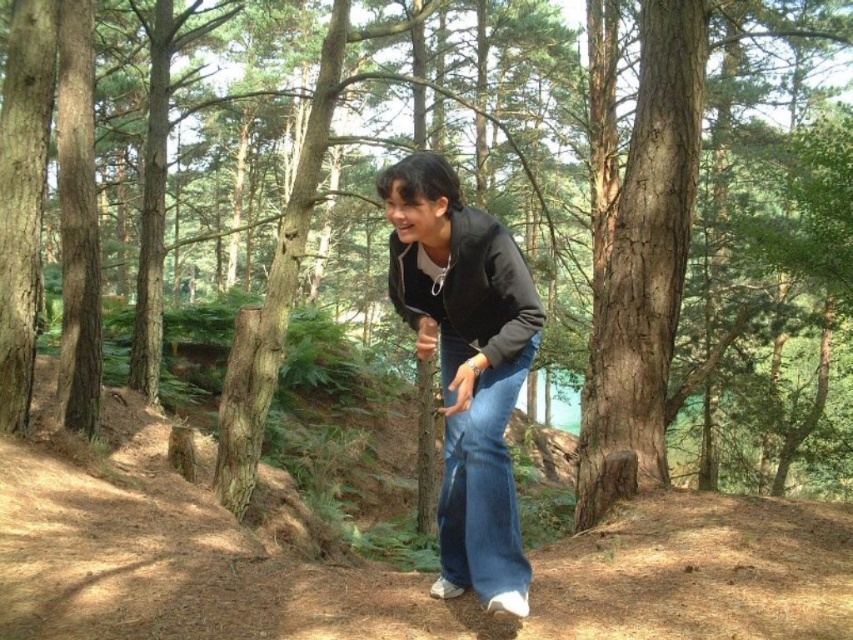
Looking at this image, is matte black jacket at center taller than denim at center?

Yes.

Who is more forward, (x=440, y=220) or (x=463, y=413)?

Point (x=440, y=220) is in front.

Where is `matte black jacket at center`? matte black jacket at center is located at coordinates (466, 365).